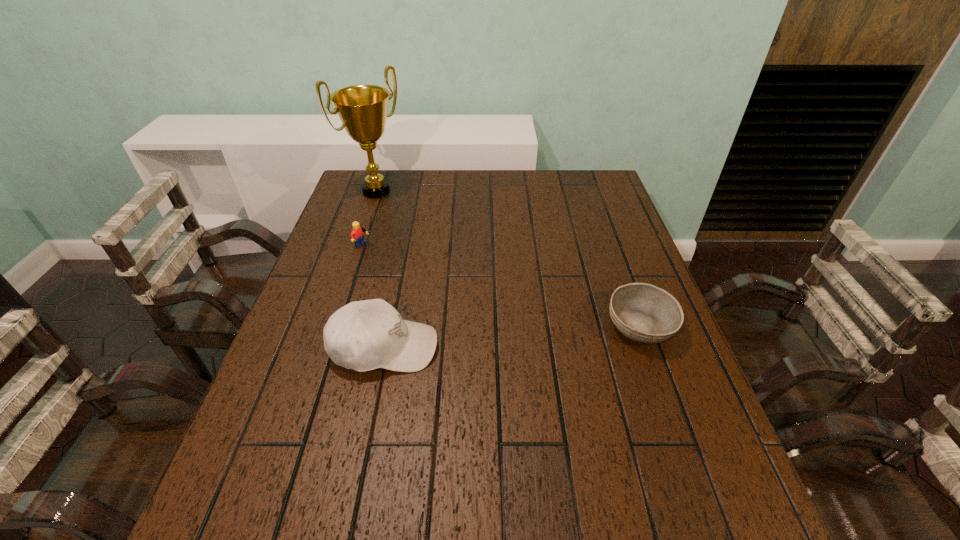
Where is `vacant region located on the front-facing side of the second farthest object`? vacant region located on the front-facing side of the second farthest object is located at coordinates (453, 291).

I want to click on vacant space located 0.250m on the front view with handles of the tallest object, so click(433, 237).

In order to click on vacant point located on the front view with handles of the tallest object in this screenshot , I will do `click(417, 224)`.

At what (x,y) coordinates should I click in order to perform the action: click on free region located on the front view with handles of the tallest object. Please return your answer as a coordinate pair (x, y). Image resolution: width=960 pixels, height=540 pixels. Looking at the image, I should click on (435, 239).

This screenshot has height=540, width=960. I want to click on object present at the far edge, so click(x=362, y=109).

At what (x,y) coordinates should I click in order to perform the action: click on baseball cap that is positioned at the left edge. Please return your answer as a coordinate pair (x, y). This screenshot has height=540, width=960. Looking at the image, I should click on (365, 335).

Identify the location of Lego located in the left edge section of the desktop. (357, 235).

Locate an element on the screen. The height and width of the screenshot is (540, 960). award that is at the left edge is located at coordinates (362, 109).

Identify the location of object that is at the right edge. (642, 312).

This screenshot has width=960, height=540. Identify the location of object that is at the far left corner. (362, 109).